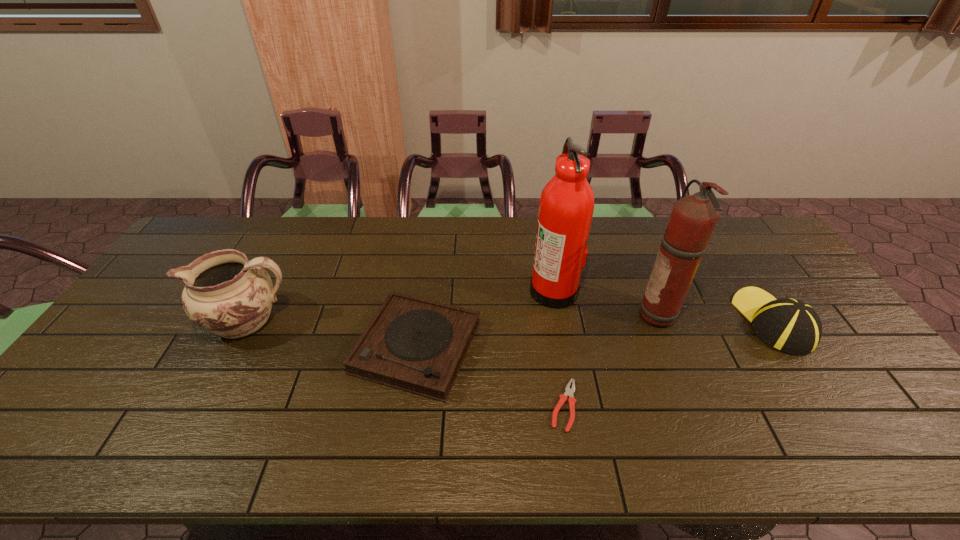
You are a GUI agent. You are given a task and a screenshot of the screen. Output one action in this format:
    pyautogui.click(x=<x>, y=<y>)
    Task: Click on the free space between the pliers and the fifth object from left to right
    
    Given the screenshot: What is the action you would take?
    pyautogui.click(x=612, y=361)

The width and height of the screenshot is (960, 540). Find the location of `free space between the right fire extinguisher and the left fire extinguisher`. free space between the right fire extinguisher and the left fire extinguisher is located at coordinates (608, 302).

What are the coordinates of `empty space that is in between the pliers and the right fire extinguisher` in the screenshot? It's located at (612, 361).

At what (x,y) coordinates should I click in order to perform the action: click on object that is the fifth closest to the leftmost object. Please return your answer as a coordinate pair (x, y). Image resolution: width=960 pixels, height=540 pixels. Looking at the image, I should click on (789, 325).

This screenshot has width=960, height=540. In order to click on object that is the fourth closest to the second object from left to right in this screenshot , I will do `click(693, 218)`.

The width and height of the screenshot is (960, 540). Identify the location of free space that satisfies the following two spatial constraints: 1. with the brim of the rightmost object facing forward; 2. on the spout of the leftmost object. (773, 321).

Identify the location of vacant area in the image that satisfies the following two spatial constraints: 1. on the spout of the pliers; 2. on the left side of the pitcher. The width and height of the screenshot is (960, 540). (204, 406).

Where is `vacant area that satisfies the following two spatial constraints: 1. on the spout of the leftmost object; 2. with the brim of the baseball cap facing forward`? The height and width of the screenshot is (540, 960). vacant area that satisfies the following two spatial constraints: 1. on the spout of the leftmost object; 2. with the brim of the baseball cap facing forward is located at coordinates (248, 321).

In order to click on vacant region that satisfies the following two spatial constraints: 1. with the brim of the baseball cap facing forward; 2. on the label side of the left fire extinguisher in this screenshot , I will do `click(752, 289)`.

What are the coordinates of `free space that satisfies the following two spatial constraints: 1. with the brim of the rightmost object facing forward; 2. on the side of the second object from right to left with the label and nozzle` in the screenshot? It's located at [769, 315].